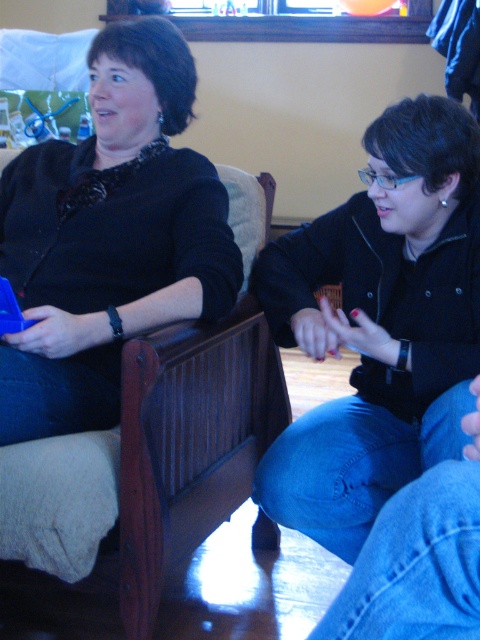
In the scene shown: Does black matte sweater at upper left lie in front of brown wood armchair at left?

No, black matte sweater at upper left is further to the viewer.

Locate an element on the screen. The image size is (480, 640). black matte sweater at upper left is located at coordinates (109, 236).

Who is positioned more to the left, black matte jacket at lower right or brown wood armchair at left?

brown wood armchair at left is more to the left.

What do you see at coordinates (380, 324) in the screenshot? I see `black matte jacket at lower right` at bounding box center [380, 324].

Identify the location of black matte jacket at lower right. (380, 324).

The image size is (480, 640). In order to click on black matte jacket at lower right in this screenshot , I will do `click(380, 324)`.

Does point (354, 524) come farther from viewer compared to point (190, 237)?

No, (354, 524) is closer to viewer.

The width and height of the screenshot is (480, 640). Describe the element at coordinates (380, 324) in the screenshot. I see `black matte jacket at lower right` at that location.

Image resolution: width=480 pixels, height=640 pixels. I want to click on black matte jacket at lower right, so click(x=380, y=324).